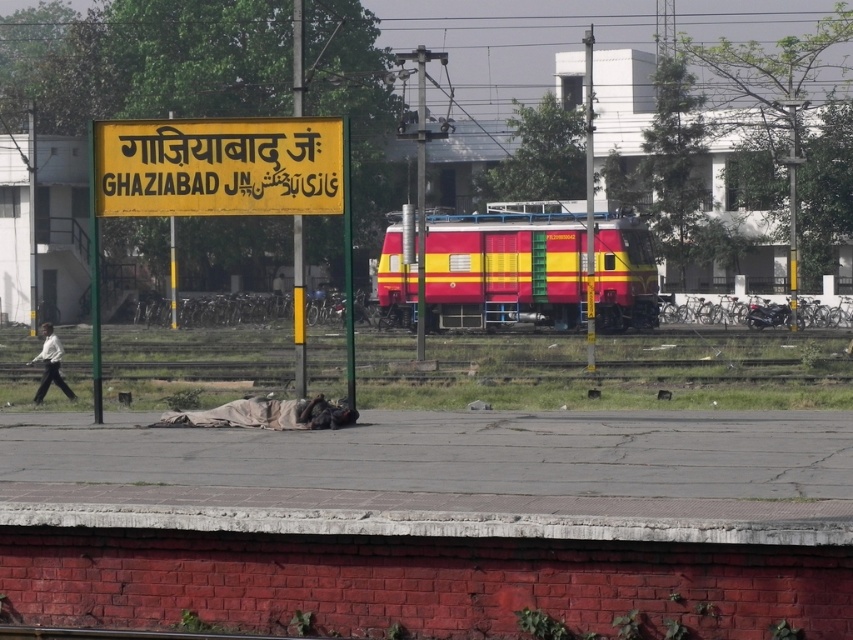
Question: Estimate the real-world distances between objects in this image. Which object is farther from the brown fabric at center?

Choices:
 (A) white matte shirt at left
 (B) metallic pole at center
 (C) dark fabric sleeping bag at center
 (D) red/yellow painted locomotive at center

Answer: (D)

Question: Can you confirm if yellow matte signboard at upper center is positioned to the right of metallic pole at center?

Choices:
 (A) yes
 (B) no

Answer: (B)

Question: In this image, where is yellow matte signboard at upper center located relative to metallic pole at center?

Choices:
 (A) above
 (B) below

Answer: (B)

Question: Does red/yellow painted locomotive at center appear on the right side of white matte shirt at left?

Choices:
 (A) yes
 (B) no

Answer: (A)

Question: Which of the following is the farthest from the observer?

Choices:
 (A) (347, 403)
 (B) (157, 147)
 (C) (490, 253)

Answer: (C)

Question: Which point is closer to the camera taking this photo?

Choices:
 (A) (302, 76)
 (B) (592, 369)
 (C) (323, 426)
 (D) (279, 426)

Answer: (D)